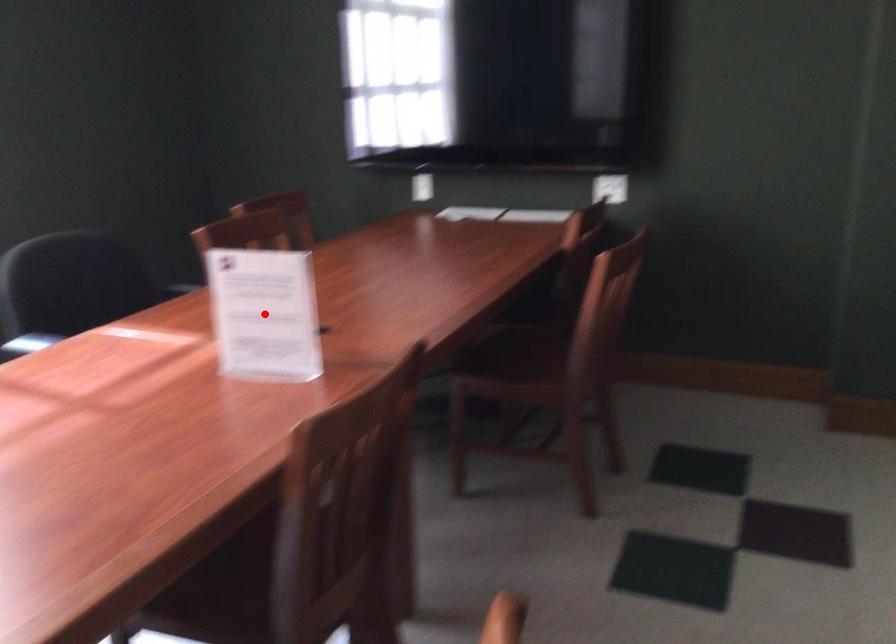
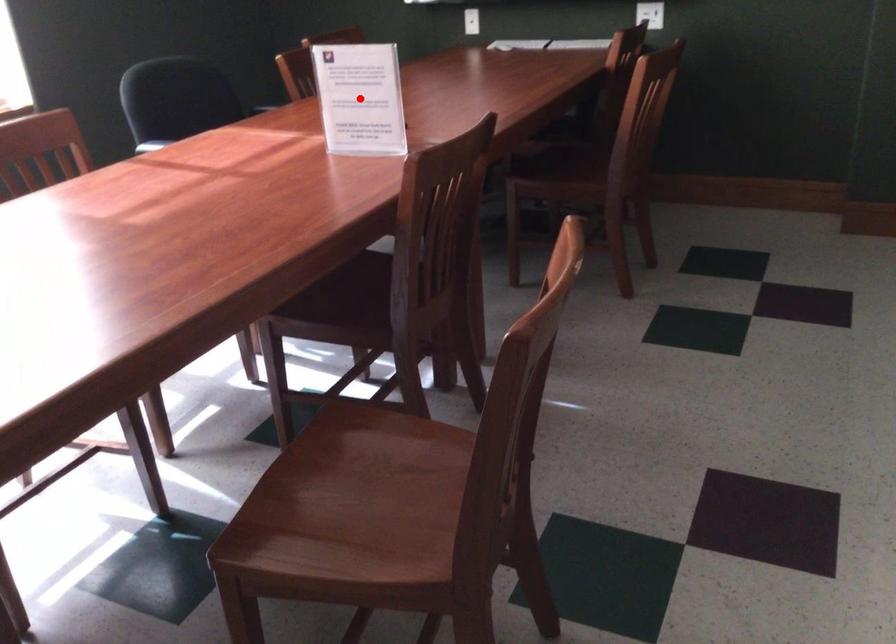
I am providing you with two images of the same scene from different viewpoints. A red point is marked on the first image and another point is marked on the second image. Is the marked point in image1 the same physical position as the marked point in image2?

Yes